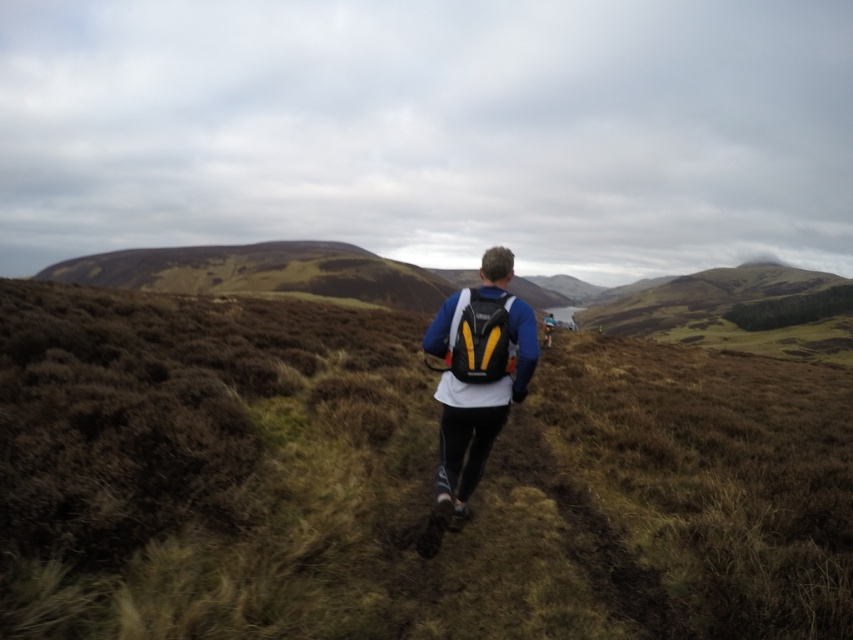
Question: Which point is farther from the camera taking this photo?

Choices:
 (A) (495, 289)
 (B) (570, 419)

Answer: (B)

Question: Does brown grassy at center come in front of white fabric backpack at center?

Choices:
 (A) yes
 (B) no

Answer: (A)

Question: Considering the relative positions of brown grassy at center and white fabric backpack at center in the image provided, where is brown grassy at center located with respect to white fabric backpack at center?

Choices:
 (A) below
 (B) above

Answer: (A)

Question: Which point appears closest to the camera in this image?

Choices:
 (A) (840, 426)
 (B) (460, 442)

Answer: (B)

Question: Is brown grassy at center smaller than white fabric backpack at center?

Choices:
 (A) no
 (B) yes

Answer: (A)

Question: Which point appears farthest from the camera in this image?

Choices:
 (A) (236, 524)
 (B) (534, 316)

Answer: (A)